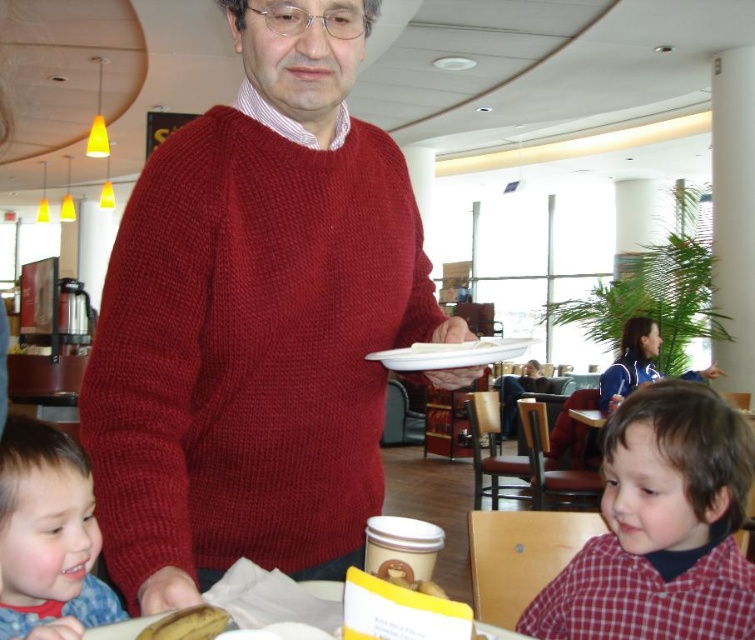
Question: Can you confirm if knitted red sweater at center is wider than smooth red shirt at lower left?

Choices:
 (A) no
 (B) yes

Answer: (B)

Question: Which object appears closest to the camera in this image?

Choices:
 (A) knitted red sweater at center
 (B) white matte plate at center

Answer: (A)

Question: Is smooth red shirt at lower left to the left of yellow matte banana at lower left from the viewer's perspective?

Choices:
 (A) yes
 (B) no

Answer: (A)

Question: Is the position of red checkered shirt at lower right less distant than that of yellow matte banana at lower left?

Choices:
 (A) no
 (B) yes

Answer: (A)

Question: Among these points, which one is nearest to the camera?

Choices:
 (A) (239, 42)
 (B) (71, 582)

Answer: (B)

Question: Which of the following is the farthest from the observer?

Choices:
 (A) (97, 381)
 (B) (418, 365)

Answer: (B)